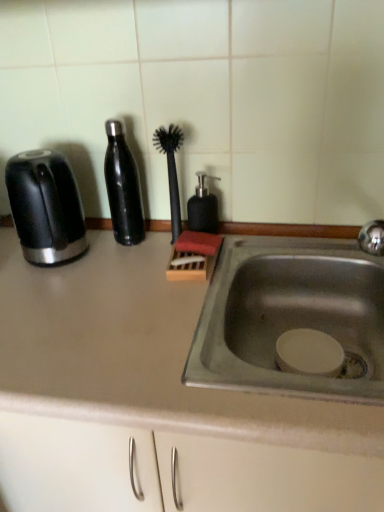
Question: Does black glossy toaster at left have a larger size compared to satin black bottle at center left?

Choices:
 (A) yes
 (B) no

Answer: (A)

Question: Does black glossy toaster at left appear on the left side of satin black bottle at center left?

Choices:
 (A) no
 (B) yes

Answer: (B)

Question: Would you say black glossy toaster at left contains satin black bottle at center left?

Choices:
 (A) no
 (B) yes

Answer: (A)

Question: From the image's perspective, does black glossy toaster at left appear lower than satin black bottle at center left?

Choices:
 (A) no
 (B) yes

Answer: (B)

Question: Is black glossy toaster at left closer to camera compared to satin black bottle at center left?

Choices:
 (A) no
 (B) yes

Answer: (B)

Question: Based on their sizes in the image, would you say satin black bottle at center left is bigger or smaller than black matte soap dispenser at center?

Choices:
 (A) small
 (B) big

Answer: (B)

Question: Considering their positions, is satin black bottle at center left located in front of or behind black matte soap dispenser at center?

Choices:
 (A) behind
 (B) front

Answer: (B)

Question: Considering the positions of satin black bottle at center left and black matte soap dispenser at center in the image, is satin black bottle at center left wider or thinner than black matte soap dispenser at center?

Choices:
 (A) wide
 (B) thin

Answer: (A)

Question: Does point (119, 155) appear closer or farther from the camera than point (200, 222)?

Choices:
 (A) closer
 (B) farther

Answer: (A)

Question: Is matte gray countertop at center in front of or behind black matte soap dispenser at center in the image?

Choices:
 (A) front
 (B) behind

Answer: (A)

Question: Does point (8, 352) appear closer or farther from the camera than point (198, 221)?

Choices:
 (A) farther
 (B) closer

Answer: (B)

Question: From a real-world perspective, is matte gray countertop at center physically located above or below black matte soap dispenser at center?

Choices:
 (A) above
 (B) below

Answer: (B)

Question: Considering the positions of matte gray countertop at center and black matte soap dispenser at center in the image, is matte gray countertop at center taller or shorter than black matte soap dispenser at center?

Choices:
 (A) short
 (B) tall

Answer: (B)

Question: Is black glossy toaster at left spatially inside black rubber brush at center, or outside of it?

Choices:
 (A) inside
 (B) outside

Answer: (B)

Question: Is black glossy toaster at left bigger or smaller than black rubber brush at center?

Choices:
 (A) small
 (B) big

Answer: (B)